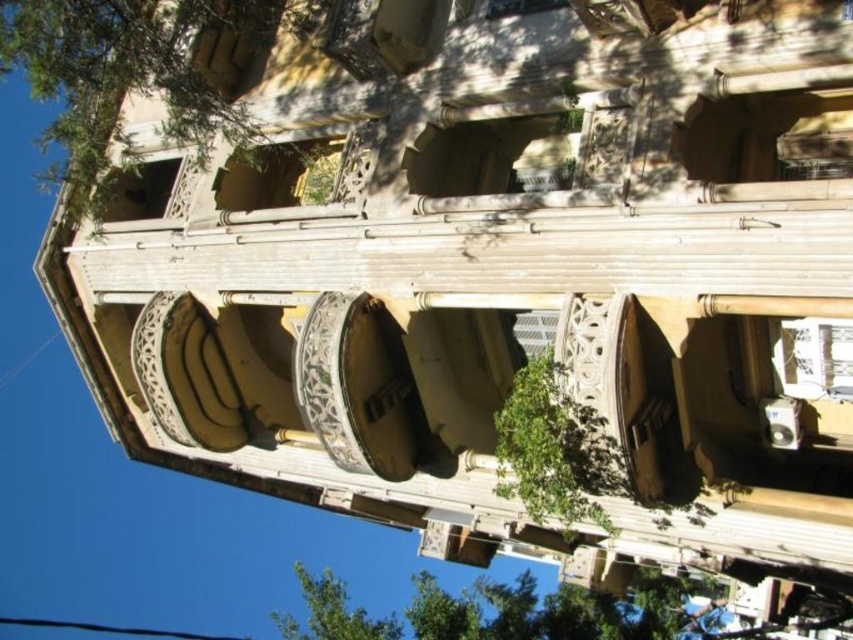
You are a window cleaner needing to clean the green leafy tree at upper left and the green leafy tree at center. Which tree requires a wider ladder because of its width?

The green leafy tree at upper left requires a wider ladder because its width surpasses the green leafy tree at center.

Based on the photo, you are standing at the entrance of the multi story building and want to find the green leafy tree at lower center. According to the coordinates provided, where should you look to locate it?

The green leafy tree at lower center is located at coordinates point (556, 611), so you should look towards the lower center area of the building to find it.